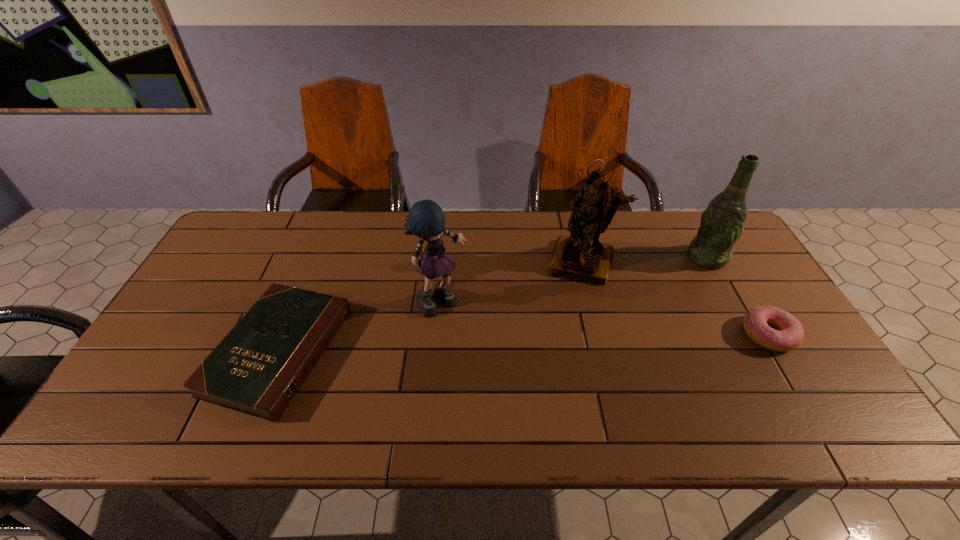
Identify the location of unoccupied position between the beer bottle and the doughnut. Image resolution: width=960 pixels, height=540 pixels. (737, 296).

Locate an element on the screen. free space between the Bible and the second object from left to right is located at coordinates (360, 326).

Identify the location of free area in between the beer bottle and the figurine. (644, 260).

The width and height of the screenshot is (960, 540). Find the location of `vacant space that is in between the leftmost object and the doughnut`. vacant space that is in between the leftmost object and the doughnut is located at coordinates (523, 343).

This screenshot has width=960, height=540. Identify the location of vacant space in between the second object from left to right and the doughnut. (605, 318).

Where is `vacant area that lies between the figurine and the doughnut`? The width and height of the screenshot is (960, 540). vacant area that lies between the figurine and the doughnut is located at coordinates (675, 298).

At what (x,y) coordinates should I click in order to perform the action: click on free area in between the fourth object from right to left and the Bible. Please return your answer as a coordinate pair (x, y). Looking at the image, I should click on (360, 326).

Locate an element on the screen. This screenshot has width=960, height=540. free space between the rag doll and the doughnut is located at coordinates coord(605,318).

Select which object appears as the fourth closest to the doughnut. Please provide its 2D coordinates. Your answer should be formatted as a tuple, i.e. [(x, y)], where the tuple contains the x and y coordinates of a point satisfying the conditions above.

[(259, 366)]

The width and height of the screenshot is (960, 540). Find the location of `the third closest object relative to the beer bottle`. the third closest object relative to the beer bottle is located at coordinates (426, 219).